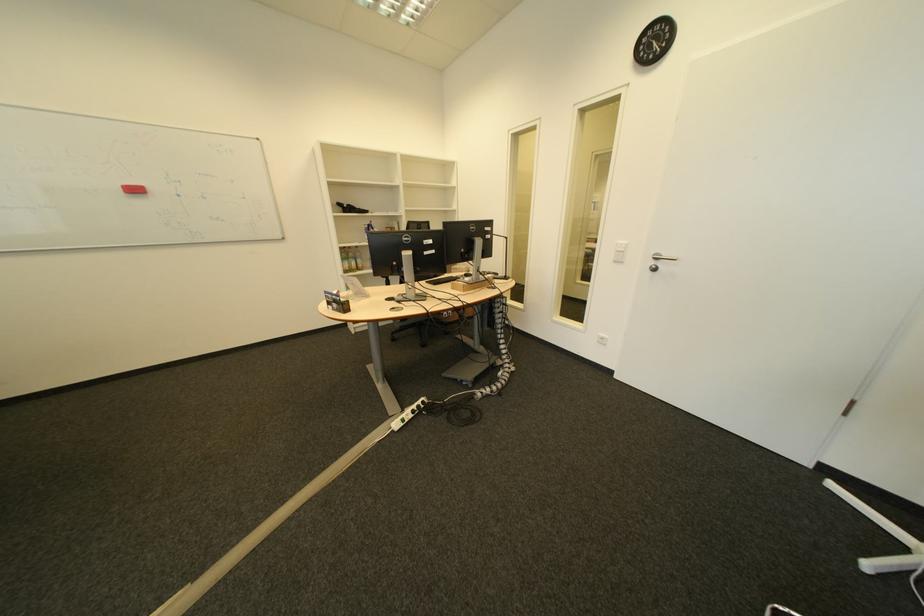
Locate an element on the screen. The image size is (924, 616). white light switch is located at coordinates (619, 252).